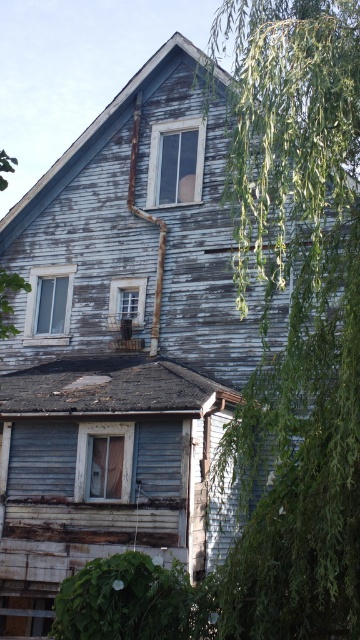
Does point (312, 166) lie in front of point (159, 198)?

Yes, point (312, 166) is closer to viewer.

Who is more forward, (353,330) or (169,168)?

Point (353,330)

Locate an element on the screen. Image resolution: width=360 pixels, height=640 pixels. green leafy tree at right is located at coordinates (297, 316).

Does clear glass window at upper center have a smaller size compared to transparent glass window at upper left?

No.

Who is taller, clear glass window at upper center or transparent glass window at upper left?

clear glass window at upper center

Between point (191, 195) and point (55, 276), which one is positioned behind?

Positioned behind is point (55, 276).

Image resolution: width=360 pixels, height=640 pixels. I want to click on clear glass window at upper center, so click(176, 163).

Can you confirm if transparent glass window at upper left is positioned below matte wood window at center?

No.

Who is higher up, transparent glass window at upper left or matte wood window at center?

transparent glass window at upper left

Is point (45, 275) closer to viewer compared to point (119, 296)?

No, (45, 275) is behind (119, 296).

Find the location of a particular element. The image size is (360, 640). transparent glass window at upper left is located at coordinates (48, 305).